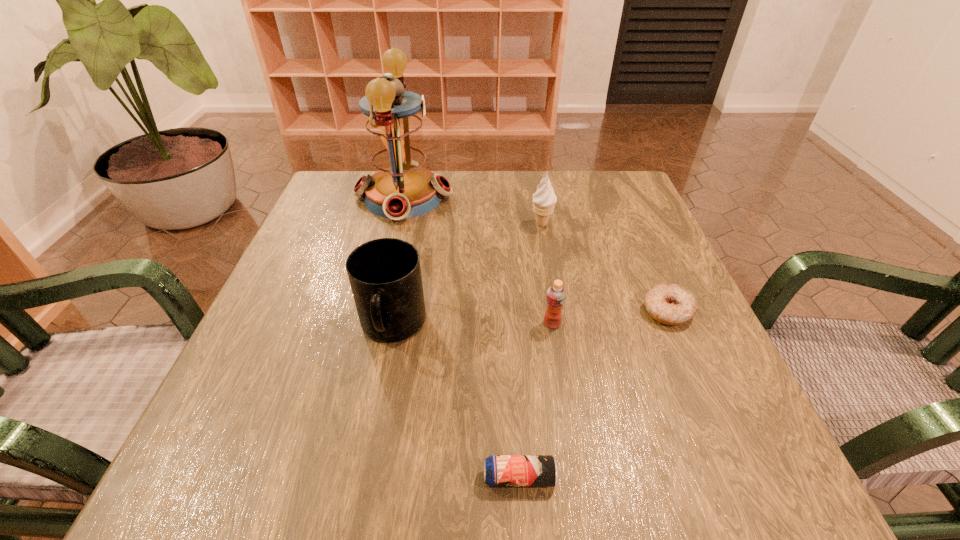
In the image, there is a desktop. Where is `vacant space at the near edge`? Image resolution: width=960 pixels, height=540 pixels. vacant space at the near edge is located at coordinates (617, 486).

Where is `free space at the left edge of the desktop`? free space at the left edge of the desktop is located at coordinates (250, 380).

In the image, there is a desktop. Identify the location of free space at the right edge. (690, 334).

Where is `vacant point at the far left corner`? The height and width of the screenshot is (540, 960). vacant point at the far left corner is located at coordinates (334, 183).

The image size is (960, 540). Find the location of `vacant area at the far right corner`. vacant area at the far right corner is located at coordinates (599, 171).

The width and height of the screenshot is (960, 540). Identify the location of free area in between the fourth object from right to left and the mug. (456, 402).

Where is `vacant point located between the beer can and the lantern`? This screenshot has width=960, height=540. vacant point located between the beer can and the lantern is located at coordinates (462, 337).

This screenshot has width=960, height=540. What are the coordinates of `free space between the doughnut and the icecream` in the screenshot? It's located at (605, 267).

You are a GUI agent. You are given a task and a screenshot of the screen. Output one action in this format:
    pyautogui.click(x=<x>, y=<y>)
    Task: Click on the vacant region between the icecream and the mug
    This screenshot has width=960, height=540.
    Given the screenshot: What is the action you would take?
    pyautogui.click(x=468, y=276)

The height and width of the screenshot is (540, 960). I want to click on free space that is in between the third object from left to right and the mug, so [x=456, y=402].